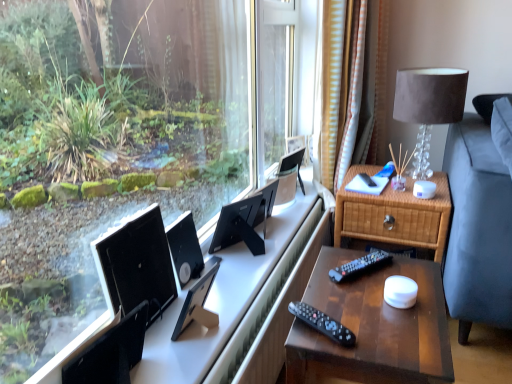
Locate an element on the screen. The width and height of the screenshot is (512, 384). blank space situated above wooden nightstand at right, which is the second nightstand in back-to-front order (from a real-world perspective) is located at coordinates (366, 302).